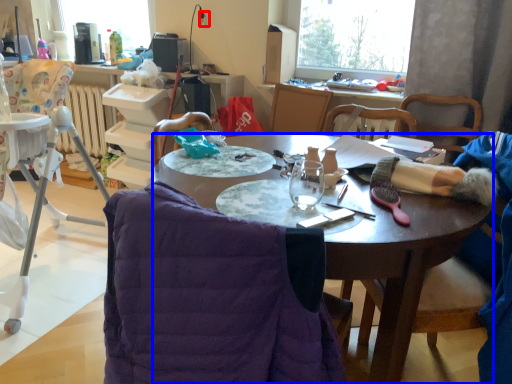
Question: Which point is further to the camera, power outlet (highlighted by a red box) or desk (highlighted by a blue box)?

Choices:
 (A) power outlet
 (B) desk

Answer: (A)